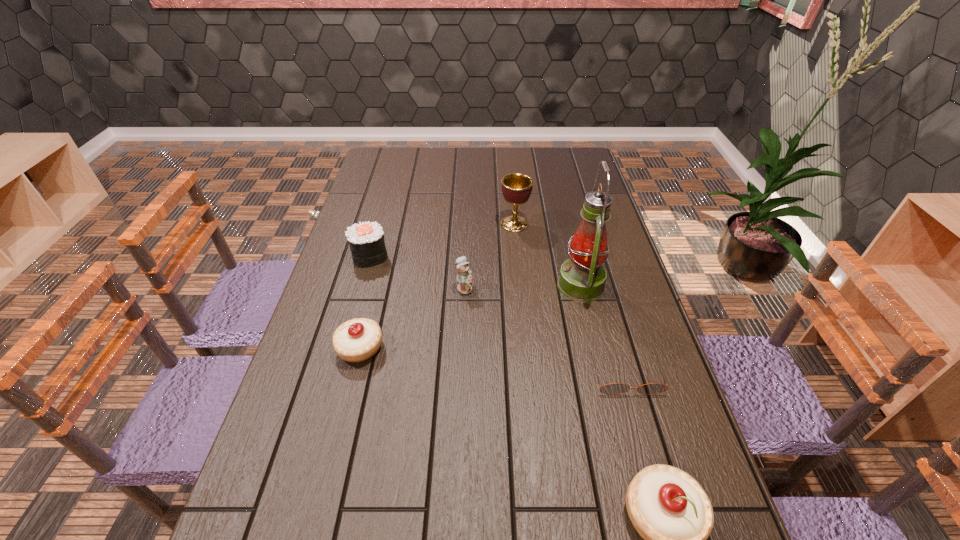
This screenshot has width=960, height=540. I want to click on free space located 0.270m on the front-facing side of the third object from left to right, so [x=565, y=288].

Identify the location of vacant space located on the front of the oil lamp. The height and width of the screenshot is (540, 960). (592, 333).

At what (x,y) coordinates should I click in order to perform the action: click on free spot located on the left of the sushi. Please return your answer as a coordinate pair (x, y). The image size is (960, 540). Looking at the image, I should click on (335, 256).

The image size is (960, 540). Find the location of `free space located 0.100m on the face of the sunglasses`. free space located 0.100m on the face of the sunglasses is located at coordinates (643, 435).

Find the location of `pastry at the left edge`. pastry at the left edge is located at coordinates (357, 340).

I want to click on sushi located at the left edge, so click(366, 240).

This screenshot has height=540, width=960. In order to click on oil lamp located in the right edge section of the desktop in this screenshot , I will do `click(582, 278)`.

Locate an element on the screen. The image size is (960, 540). sunglasses that is positioned at the right edge is located at coordinates (615, 388).

Find the location of a particular element. The image size is (960, 540). vacant space at the far edge of the desktop is located at coordinates point(453,158).

This screenshot has height=540, width=960. In the image, there is a desktop. What are the coordinates of `vacant space at the near edge` in the screenshot? It's located at (576, 526).